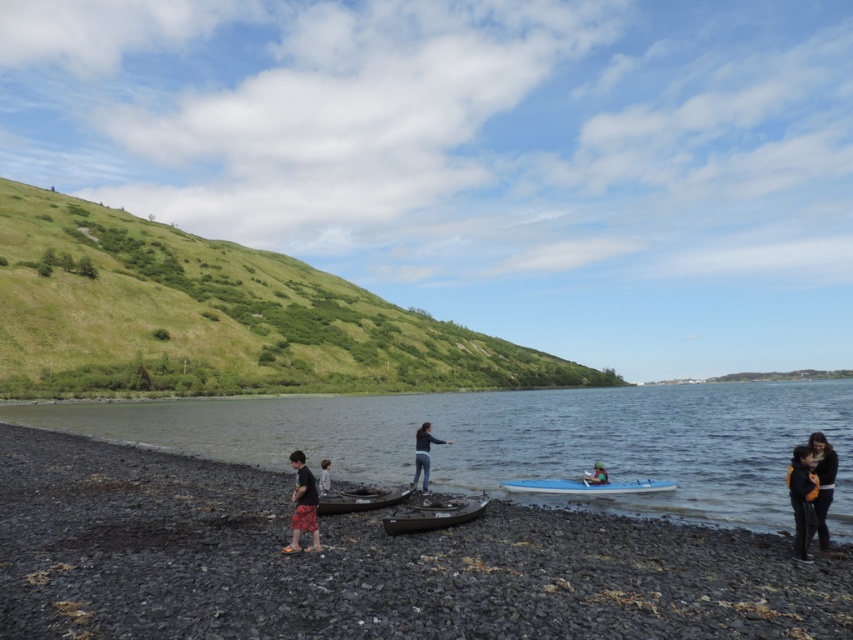
You are standing at the center of the image and want to locate the matte black canoe at center. Which direction should you look to find it?

The matte black canoe at center is located at the center of the image, so you should look straight ahead to find it.

You are standing at the lakeside and see both the blue jeans at center and the blue glossy surfboard at center. Which object is larger in size?

The blue jeans at center is bigger than the blue glossy surfboard at center.